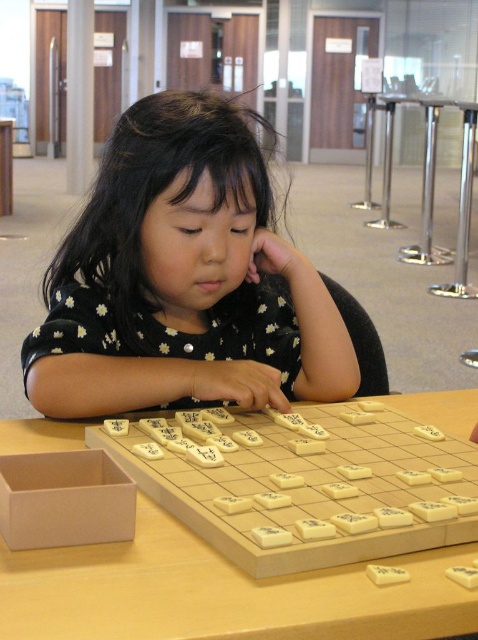
Question: Which object is farther from the camera taking this photo?

Choices:
 (A) black dotted shirt at center
 (B) wooden at center

Answer: (A)

Question: Which object appears closest to the camera in this image?

Choices:
 (A) black dotted shirt at center
 (B) wooden at center

Answer: (B)

Question: Does black dotted shirt at center appear on the left side of wooden at center?

Choices:
 (A) no
 (B) yes

Answer: (A)

Question: Which point appears closest to the camera in this image?

Choices:
 (A) (138, 170)
 (B) (24, 604)

Answer: (B)

Question: Is black dotted shirt at center to the right of wooden at center from the viewer's perspective?

Choices:
 (A) yes
 (B) no

Answer: (A)

Question: Can you confirm if black dotted shirt at center is thinner than wooden at center?

Choices:
 (A) no
 (B) yes

Answer: (B)